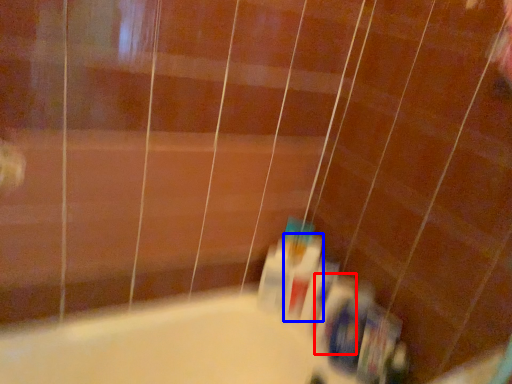
Question: Which of the following is the farthest to the observer, toiletry (highlighted by a red box) or mouthwash (highlighted by a blue box)?

Choices:
 (A) toiletry
 (B) mouthwash

Answer: (B)